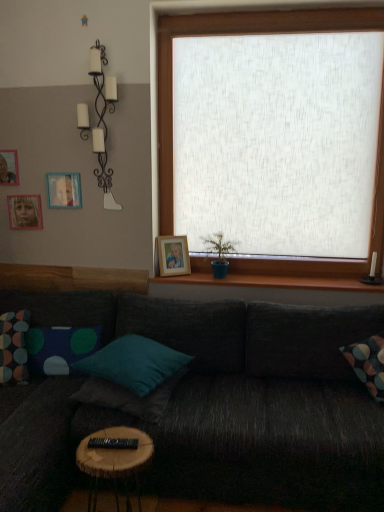
Where is `free space above wooden at lower center (from a real-world perspective)`? The width and height of the screenshot is (384, 512). free space above wooden at lower center (from a real-world perspective) is located at coordinates (263, 277).